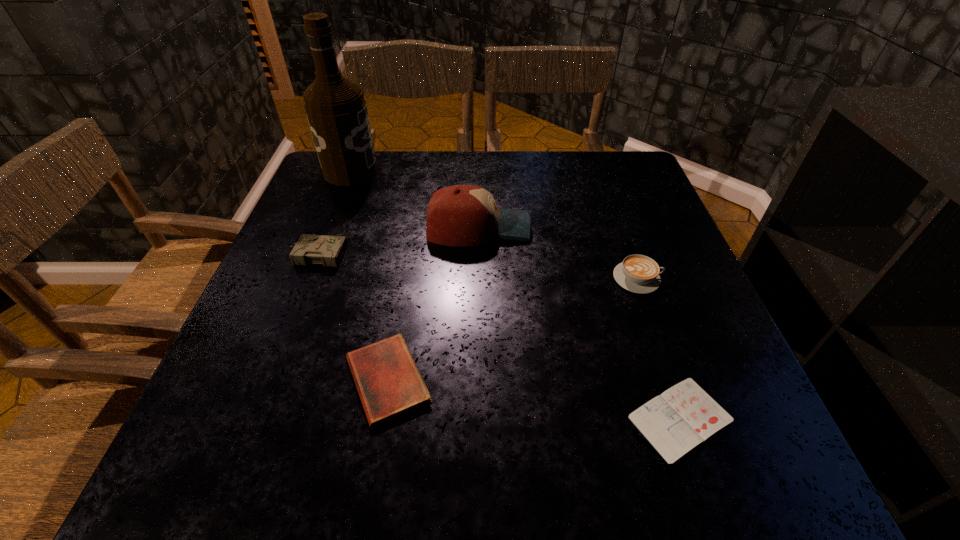
Identify the location of object that is the closest one to the alcohol. (461, 215).

Locate which diary ranks third in proximity to the alcohol. Please provide its 2D coordinates. Your answer should be formatted as a tuple, i.e. [(x, y)], where the tuple contains the x and y coordinates of a point satisfying the conditions above.

[(682, 417)]

Select which diary is the closest to the second tallest object. Please provide its 2D coordinates. Your answer should be formatted as a tuple, i.e. [(x, y)], where the tuple contains the x and y coordinates of a point satisfying the conditions above.

[(310, 249)]

Locate an element on the screen. This screenshot has width=960, height=540. vacant space that satisfies the following two spatial constraints: 1. on the label of the shortest diary; 2. on the right side of the farthest object is located at coordinates (255, 418).

The height and width of the screenshot is (540, 960). In order to click on blank space that satisfies the following two spatial constraints: 1. on the label of the alcohol; 2. on the right side of the second diary from right to left in this screenshot , I will do `click(271, 380)`.

Image resolution: width=960 pixels, height=540 pixels. I want to click on vacant position in the image that satisfies the following two spatial constraints: 1. on the side of the cappuccino with the handle; 2. on the front side of the second tallest diary, so click(674, 380).

Where is `vacant space that satisfies the following two spatial constraints: 1. on the front side of the fifth tallest object; 2. on the right side of the shortest diary`? Image resolution: width=960 pixels, height=540 pixels. vacant space that satisfies the following two spatial constraints: 1. on the front side of the fifth tallest object; 2. on the right side of the shortest diary is located at coordinates (381, 418).

Image resolution: width=960 pixels, height=540 pixels. What are the coordinates of `free point that satisfies the following two spatial constraints: 1. on the front-facing side of the fifth shortest object; 2. on the right side of the shortest object` in the screenshot? It's located at (477, 418).